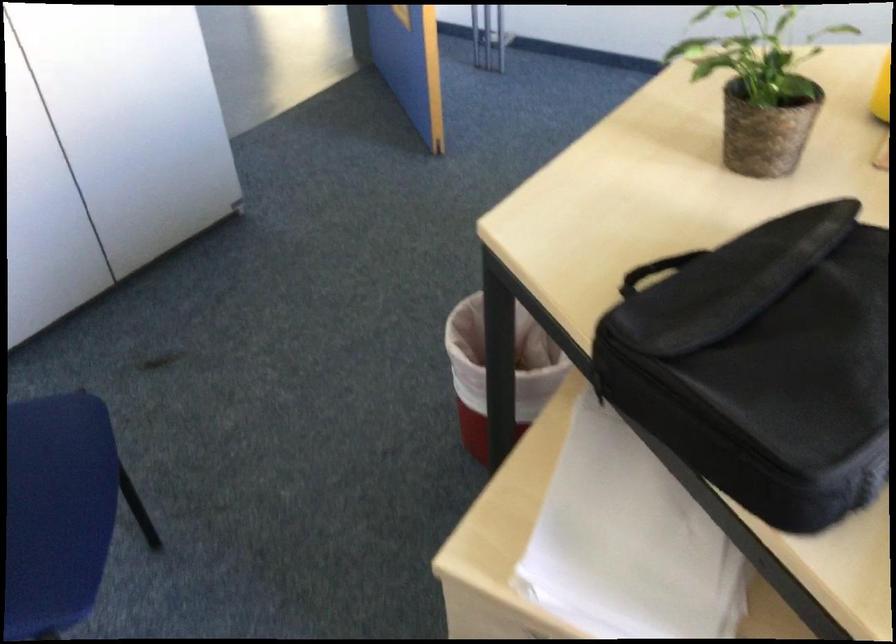
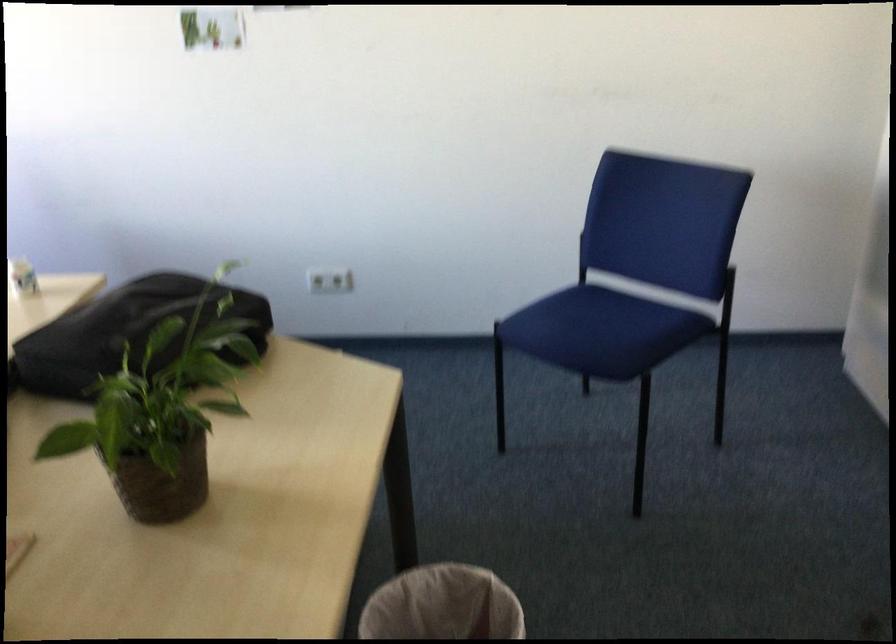
Locate, in the second image, the point that corresponds to point 746,109 in the first image.

(162, 413)